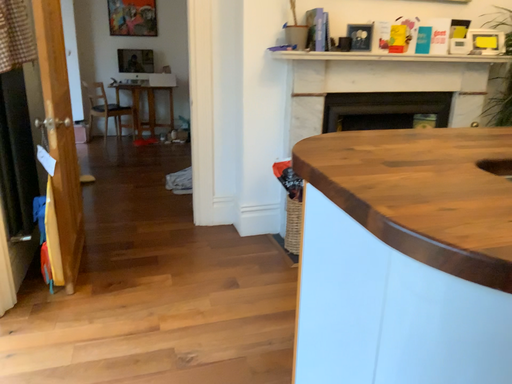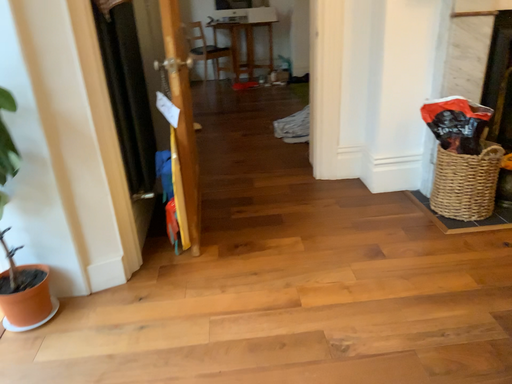
Question: Which way did the camera rotate in the video?

Choices:
 (A) rotated downward
 (B) rotated upward

Answer: (A)